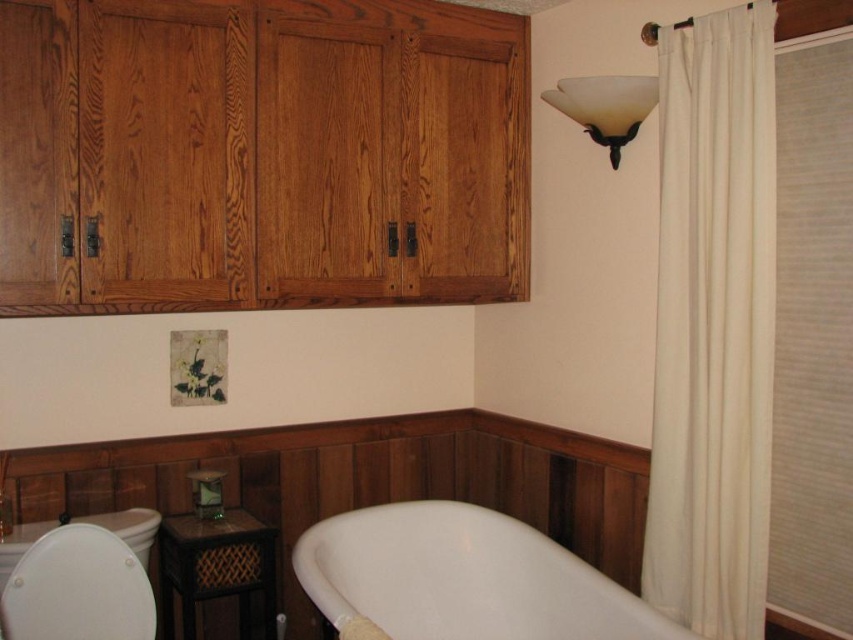
Does white fabric shower curtain at right have a smaller size compared to white matte shower curtain at upper right?

Actually, white fabric shower curtain at right might be larger than white matte shower curtain at upper right.

Based on the photo, does white fabric shower curtain at right appear over white matte shower curtain at upper right?

Actually, white fabric shower curtain at right is below white matte shower curtain at upper right.

Where is `white fabric shower curtain at right`? This screenshot has width=853, height=640. white fabric shower curtain at right is located at coordinates (712, 324).

Does white glossy toilet bowl at lower left have a lesser height compared to white frosted glass sconce at upper right?

In fact, white glossy toilet bowl at lower left may be taller than white frosted glass sconce at upper right.

Which is below, white glossy toilet bowl at lower left or white frosted glass sconce at upper right?

white glossy toilet bowl at lower left is lower down.

Where is `white glossy toilet bowl at lower left`? The height and width of the screenshot is (640, 853). white glossy toilet bowl at lower left is located at coordinates (78, 588).

This screenshot has height=640, width=853. I want to click on white glossy toilet bowl at lower left, so click(x=78, y=588).

Does white fabric shower curtain at right have a smaller size compared to white frosted glass sconce at upper right?

No, white fabric shower curtain at right is not smaller than white frosted glass sconce at upper right.

Is point (692, 524) more distant than point (637, 106)?

No, it is not.

Between point (767, 353) and point (611, 156), which one is positioned behind?

The point (611, 156) is behind.

I want to click on white fabric shower curtain at right, so click(x=712, y=324).